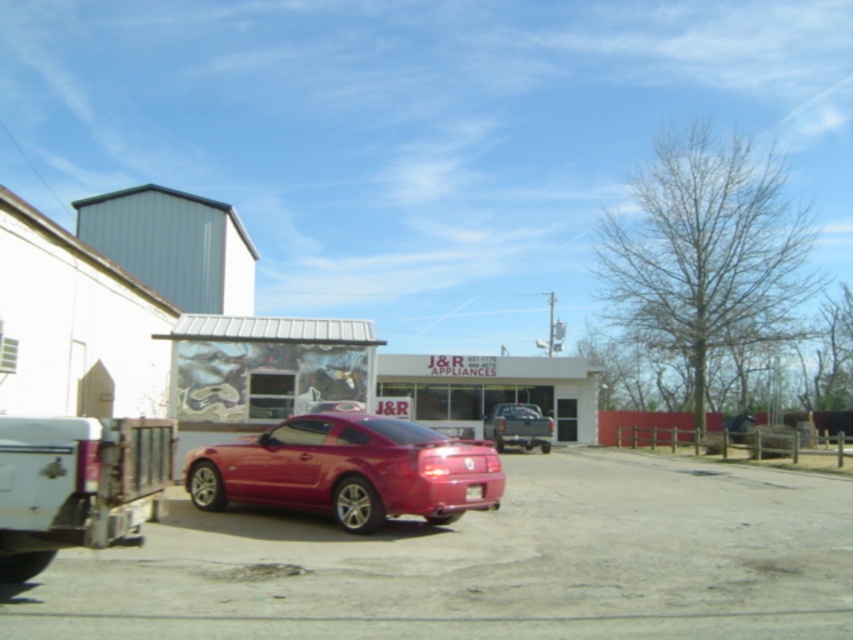
Question: Does white matte truck at lower left have a larger size compared to matte black truck at center?

Choices:
 (A) no
 (B) yes

Answer: (B)

Question: Which object is farther from the camera taking this photo?

Choices:
 (A) white matte truck at lower left
 (B) glossy red car at center

Answer: (B)

Question: Which point is closer to the camera?

Choices:
 (A) (6, 436)
 (B) (497, 442)

Answer: (A)

Question: Does glossy red car at center lie in front of white matte truck at lower left?

Choices:
 (A) no
 (B) yes

Answer: (A)

Question: Which of the following is the farthest from the observer?

Choices:
 (A) glossy red car at center
 (B) matte black truck at center

Answer: (B)

Question: Is glossy red car at center positioned in front of matte black truck at center?

Choices:
 (A) yes
 (B) no

Answer: (A)